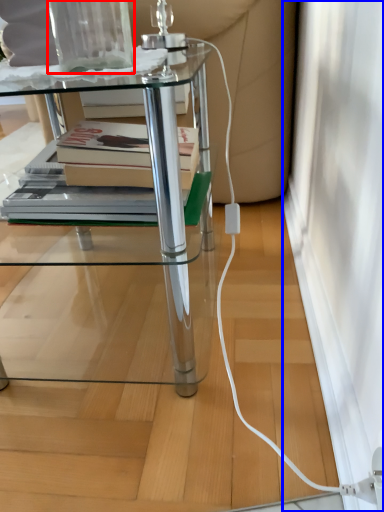
Question: Which point is further to the camera, glass vase (highlighted by a red box) or screen door (highlighted by a blue box)?

Choices:
 (A) glass vase
 (B) screen door

Answer: (B)